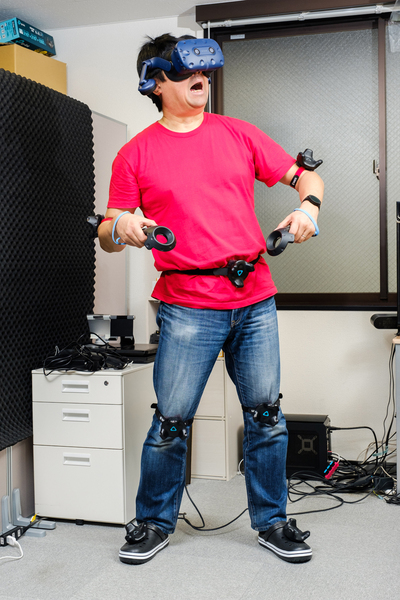
What are the coordinates of `corners of back window` in the screenshot? It's located at (377, 290), (221, 42).